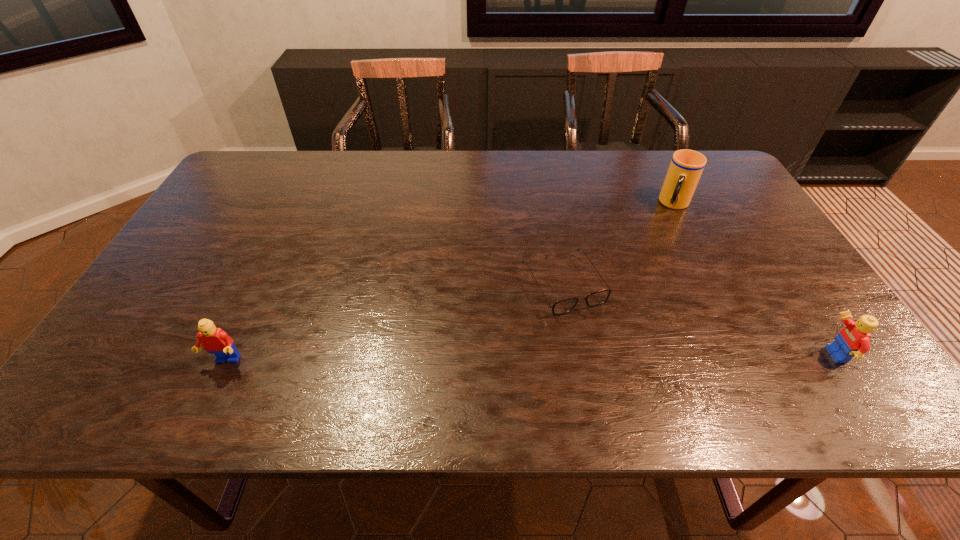
Identify the location of free area in between the tallest object and the left Lego. This screenshot has width=960, height=540. (450, 283).

Where is `vacant space in between the rightmost object and the tallest object`? The width and height of the screenshot is (960, 540). vacant space in between the rightmost object and the tallest object is located at coordinates (754, 280).

You are a GUI agent. You are given a task and a screenshot of the screen. Output one action in this format:
    pyautogui.click(x=<x>, y=<y>)
    Task: Click on the vacant space that's between the leftmost object and the sunglasses
    
    Given the screenshot: What is the action you would take?
    pyautogui.click(x=394, y=323)

Where is `free spot between the left Lego and the second farthest object`? The height and width of the screenshot is (540, 960). free spot between the left Lego and the second farthest object is located at coordinates (394, 323).

Where is `empty space between the second farthest object and the left Lego`? The width and height of the screenshot is (960, 540). empty space between the second farthest object and the left Lego is located at coordinates (394, 323).

Locate an element on the screen. vacant space that's between the farthest object and the leftmost object is located at coordinates (450, 283).

Where is `vacant region between the leftmost object and the second object from left to right`? vacant region between the leftmost object and the second object from left to right is located at coordinates (394, 323).

At what (x,y) coordinates should I click in order to perform the action: click on vacant space that's between the left Lego and the rightmost object. Please return your answer as a coordinate pair (x, y). Looking at the image, I should click on (528, 359).

The height and width of the screenshot is (540, 960). In order to click on free space between the left Lego and the second object from right to left in this screenshot , I will do `click(450, 283)`.

Locate an element on the screen. The width and height of the screenshot is (960, 540). free space between the tallest object and the left Lego is located at coordinates (450, 283).